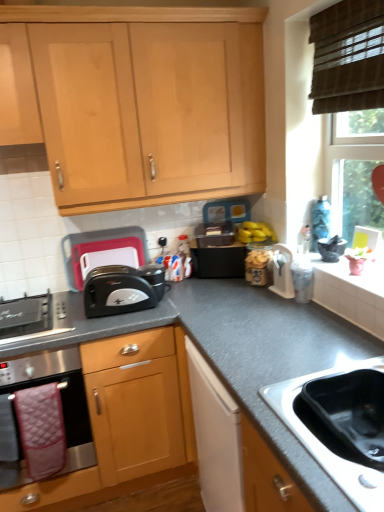
This screenshot has height=512, width=384. In order to click on vacant region to the left of white plastic container at upper right, the second appliance in the back-to-front sequence in this screenshot , I will do `click(253, 291)`.